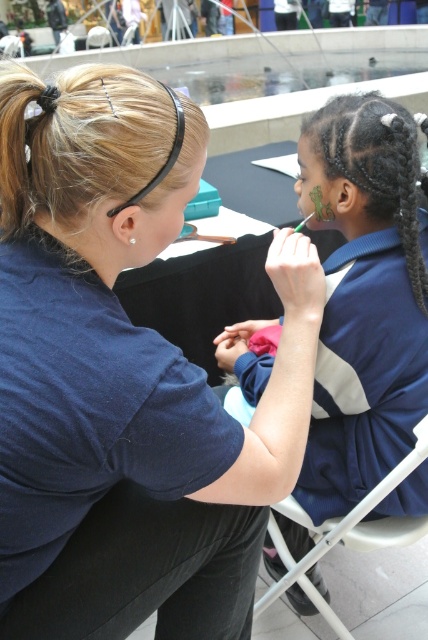
Question: Is matte blue shirt at center closer to camera compared to blue fabric shirt at upper right?

Choices:
 (A) yes
 (B) no

Answer: (A)

Question: Which point is closer to the camera taking this photo?

Choices:
 (A) (359, 540)
 (B) (196, 508)

Answer: (B)

Question: Is matte blue shirt at center to the right of blue fabric shirt at upper right from the viewer's perspective?

Choices:
 (A) yes
 (B) no

Answer: (B)

Question: Which object is positioned farthest from the white plastic chair at lower right?

Choices:
 (A) blue fabric shirt at upper right
 (B) matte blue shirt at center

Answer: (B)

Question: Can you confirm if matte blue shirt at center is wider than white plastic chair at lower right?

Choices:
 (A) yes
 (B) no

Answer: (A)

Question: Which of the following is the farthest from the observer?

Choices:
 (A) (389, 333)
 (B) (121, 588)
 (C) (314, 568)

Answer: (C)